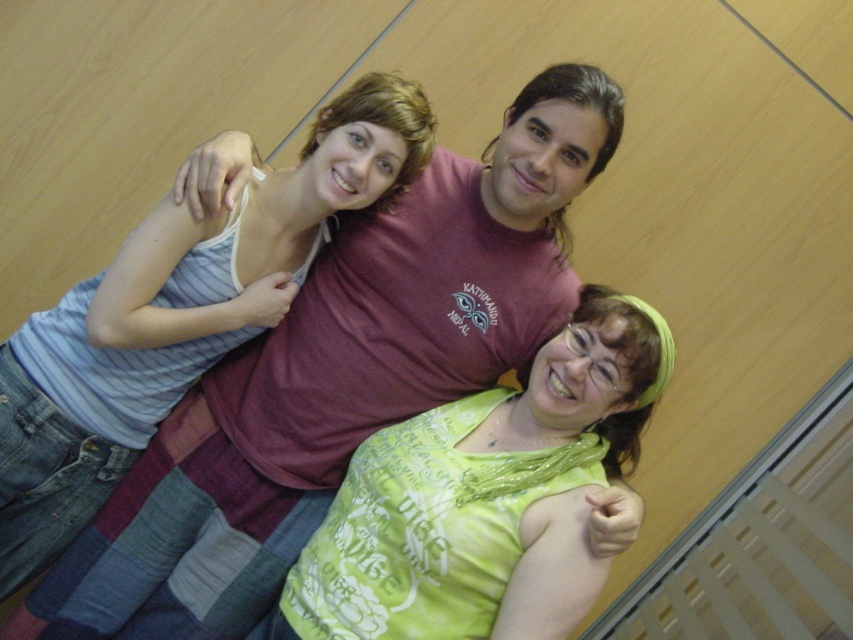
You are taking a photo of three friends. You notice the green fabric shirt at center and the striped cotton tank top at upper left. Which clothing item is positioned more to the right in the image?

The green fabric shirt at center is positioned more to the right than the striped cotton tank top at upper left.

Based on the coordinates provided, which object corresponds to the point at location [483,499]?

The point at [483,499] corresponds to the green fabric shirt at center.